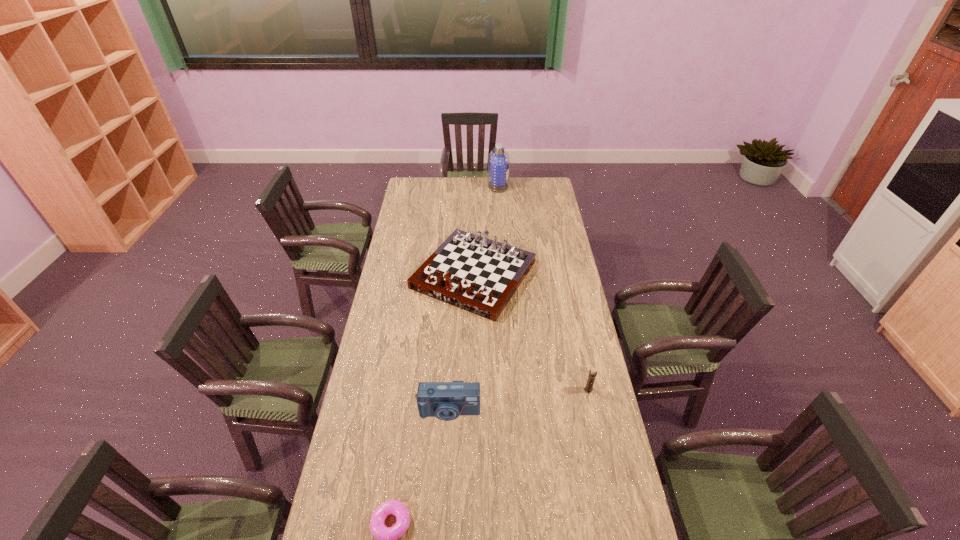
This screenshot has height=540, width=960. Find the location of `the tallest object`. the tallest object is located at coordinates (498, 160).

This screenshot has height=540, width=960. Find the location of `cleansing agent`. cleansing agent is located at coordinates (498, 160).

The width and height of the screenshot is (960, 540). I want to click on gameboard, so click(x=474, y=273).

At what (x,y) coordinates should I click in order to perform the action: click on the fourth farthest object. Please return your answer as a coordinate pair (x, y). The image size is (960, 540). Looking at the image, I should click on (446, 401).

Where is `the rightmost object`? Image resolution: width=960 pixels, height=540 pixels. the rightmost object is located at coordinates (592, 374).

Locate an element on the screen. The height and width of the screenshot is (540, 960). the third nearest object is located at coordinates (592, 374).

Where is `free space located 0.170m on the left of the cleansing agent`? Image resolution: width=960 pixels, height=540 pixels. free space located 0.170m on the left of the cleansing agent is located at coordinates (461, 186).

Find the location of a particular element. vacant space located 0.370m on the front of the gameboard is located at coordinates (472, 395).

Find the location of a particular element. This screenshot has width=960, height=540. vacant space situated on the lens of the second nearest object is located at coordinates (443, 518).

What are the coordinates of `vacant space situated 0.050m on the front of the third farthest object` in the screenshot? It's located at (592, 406).